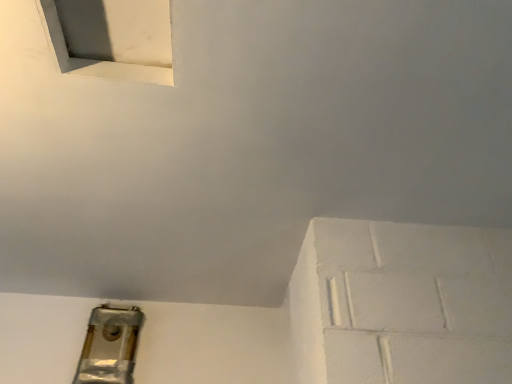
Identify the location of white matte window at upper left. This screenshot has height=384, width=512. (111, 38).

What do you see at coordinates (111, 38) in the screenshot? I see `white matte window at upper left` at bounding box center [111, 38].

Identify the location of white matte window at upper left. (111, 38).